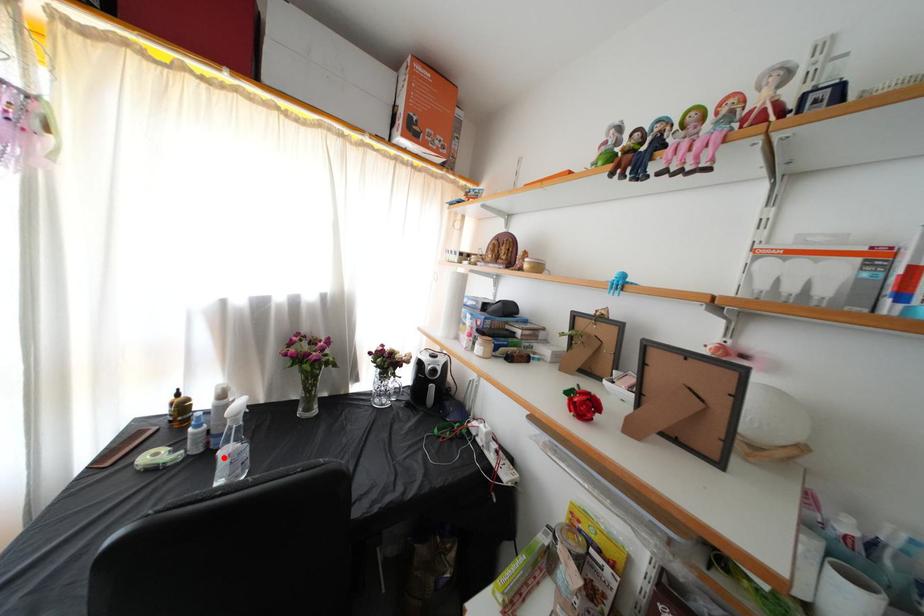
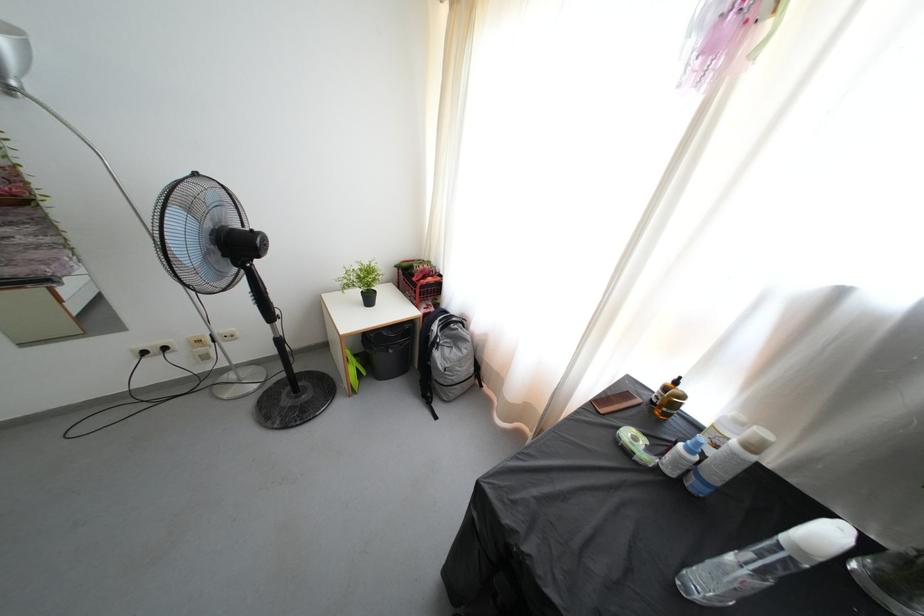
Find the pixel in the second image that matches the highlighted location in the first image.

(736, 564)